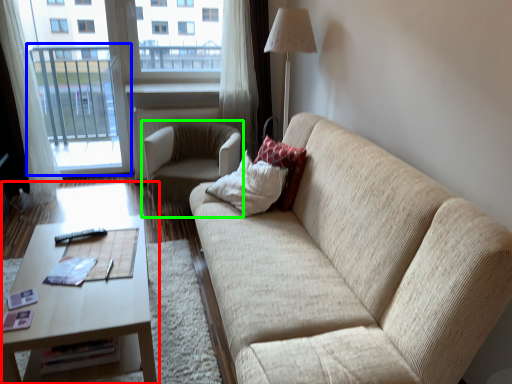
Question: Considering the real-world distances, which object is farthest from coffee table (highlighted by a red box)? screen door (highlighted by a blue box) or chair (highlighted by a green box)?

Choices:
 (A) screen door
 (B) chair

Answer: (A)